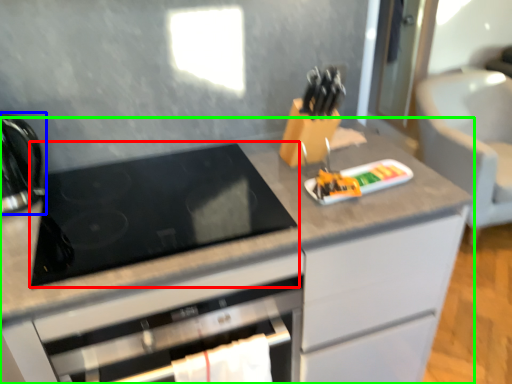
Question: Which is farther away from gas stove (highlighted by a red box)? kitchen appliance (highlighted by a blue box) or cabinetry (highlighted by a green box)?

Choices:
 (A) kitchen appliance
 (B) cabinetry

Answer: (A)